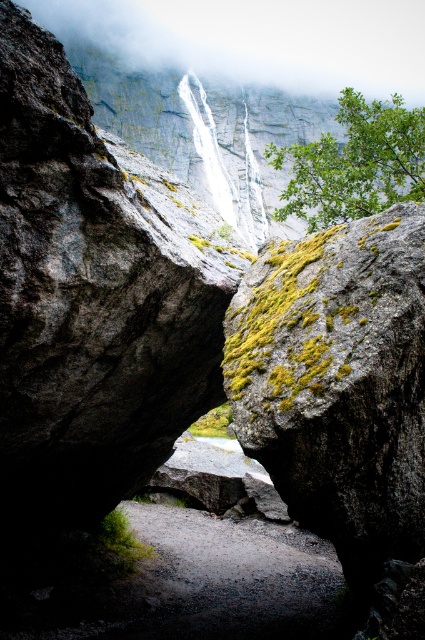
Question: Where is white misty fog at upper center located in relation to white smooth waterfall at center in the image?

Choices:
 (A) right
 (B) left

Answer: (A)

Question: Which of the following is the farthest from the observer?

Choices:
 (A) (217, 163)
 (B) (159, 600)

Answer: (A)

Question: Does gray gravel path at center have a smaller size compared to white smooth waterfall at center?

Choices:
 (A) yes
 (B) no

Answer: (A)

Question: Observing the image, what is the correct spatial positioning of gray gravel path at center in reference to white smooth waterfall at center?

Choices:
 (A) left
 (B) right

Answer: (B)

Question: Which of the following is the farthest from the observer?

Choices:
 (A) white smooth waterfall at center
 (B) gray gravel path at center
 (C) white misty fog at upper center

Answer: (C)

Question: Which point is farther to the camera?

Choices:
 (A) white smooth waterfall at center
 (B) white misty fog at upper center

Answer: (B)